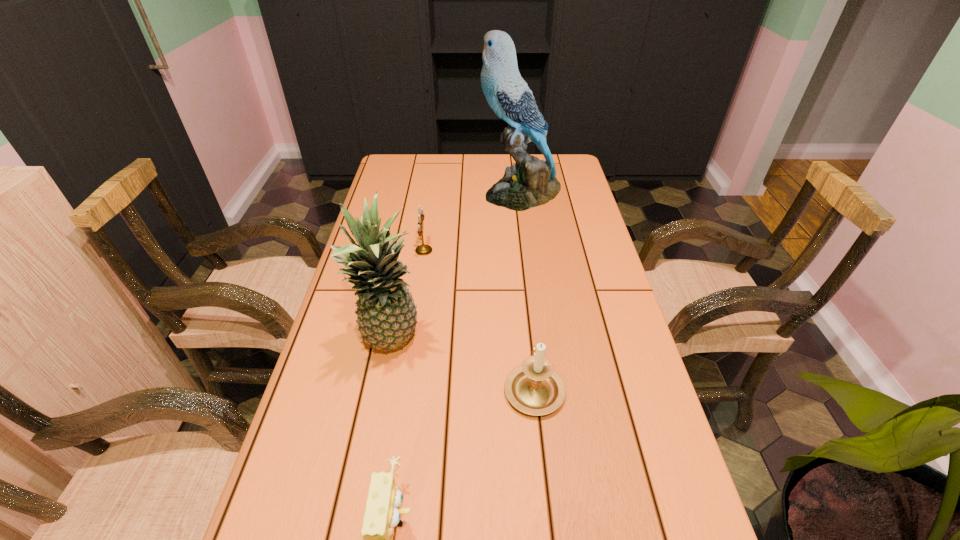
Find the location of `free spot located 0.360m with a handle on the side of the right candelabrum`. free spot located 0.360m with a handle on the side of the right candelabrum is located at coordinates (520, 261).

In order to click on blank space located with a handle on the side of the right candelabrum in this screenshot , I will do `click(522, 280)`.

The image size is (960, 540). In order to click on vacant space situated 0.100m with a handle on the side of the right candelabrum in this screenshot , I will do `click(527, 327)`.

Where is `free location located on the front of the fourth nearest object`? Image resolution: width=960 pixels, height=540 pixels. free location located on the front of the fourth nearest object is located at coordinates (407, 364).

This screenshot has height=540, width=960. Find the location of `object at the far edge`. object at the far edge is located at coordinates (530, 182).

Locate an element on the screen. This screenshot has width=960, height=540. object that is positioned at the left edge is located at coordinates (386, 314).

Identify the location of object located in the right edge section of the desktop. (530, 182).

Locate an element on the screen. object present at the far right corner is located at coordinates (530, 182).

You are a GUI agent. You are given a task and a screenshot of the screen. Output one action in this format:
    pyautogui.click(x=<x>, y=<y>)
    Task: Click on the free space at the left edge of the desktop
    The width and height of the screenshot is (960, 540).
    Given the screenshot: What is the action you would take?
    pyautogui.click(x=326, y=381)

This screenshot has height=540, width=960. In the image, there is a desktop. Identify the location of free region at the right edge. (545, 211).